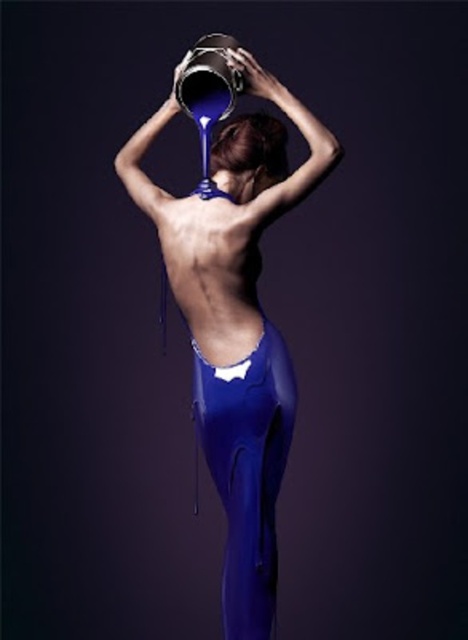
Question: Can you confirm if glossy blue liquid at upper center is bigger than satin brown hair at upper center?

Choices:
 (A) no
 (B) yes

Answer: (B)

Question: Does shiny blue tight at lower center appear on the right side of satin brown hair at upper center?

Choices:
 (A) no
 (B) yes

Answer: (A)

Question: Which of the following is the farthest from the observer?

Choices:
 (A) (214, 349)
 (B) (239, 387)

Answer: (A)

Question: Which is nearer to the shiny blue tight at lower center?

Choices:
 (A) glossy blue liquid at upper center
 (B) satin brown hair at upper center

Answer: (A)

Question: Estimate the real-world distances between objects in this image. Which object is closer to the white matte bikini top at center?

Choices:
 (A) satin brown hair at upper center
 (B) glossy blue liquid at upper center
 (C) shiny blue tight at lower center

Answer: (A)

Question: Where is satin brown hair at upper center located in relation to white matte bikini top at center in the image?

Choices:
 (A) left
 (B) right

Answer: (B)